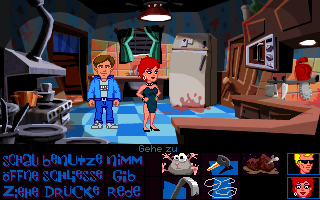
Find the location of a particular element. microwave is located at coordinates (260, 59).